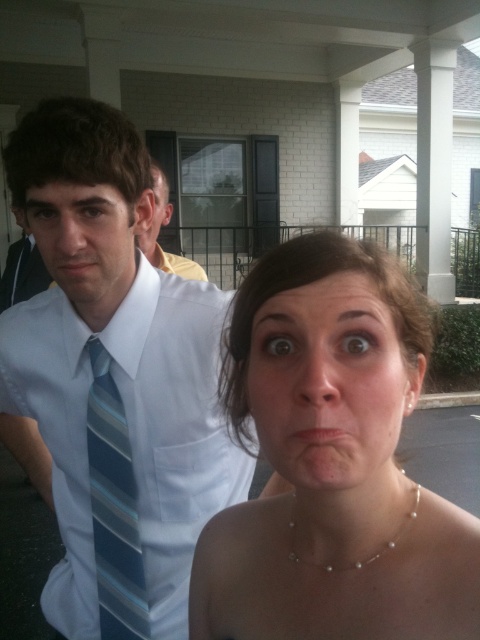
Question: Which of the following is the closest to the observer?

Choices:
 (A) (167, 268)
 (B) (105, 595)
 (C) (375, 394)
 (D) (144, 189)

Answer: (C)

Question: Which object appears closest to the camera in this image?

Choices:
 (A) smooth skin face at center
 (B) pearl necklace at center

Answer: (A)

Question: Does pearl necklace at center appear on the right side of matte white ear at center?

Choices:
 (A) no
 (B) yes

Answer: (B)

Question: Which point is closer to the camera taking this photo?

Choices:
 (A) (344, 365)
 (B) (218, 536)
 (C) (137, 474)

Answer: (A)

Question: From the image, what is the correct spatial relationship of white shirt at center in relation to matte white ear at center?

Choices:
 (A) above
 (B) below

Answer: (B)

Question: Can you confirm if white striped tie at left is positioned below blue striped tie at left?

Choices:
 (A) yes
 (B) no

Answer: (B)